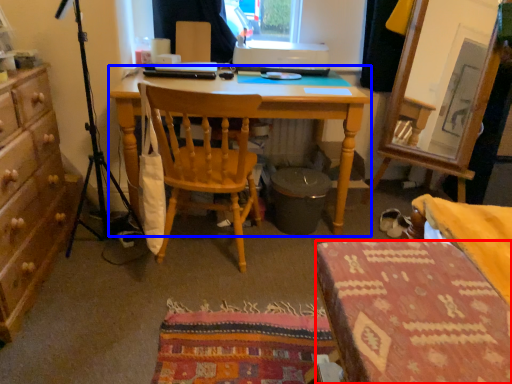
Question: Which point is closer to the camera, stool (highlighted by a red box) or desk (highlighted by a blue box)?

Choices:
 (A) stool
 (B) desk

Answer: (A)